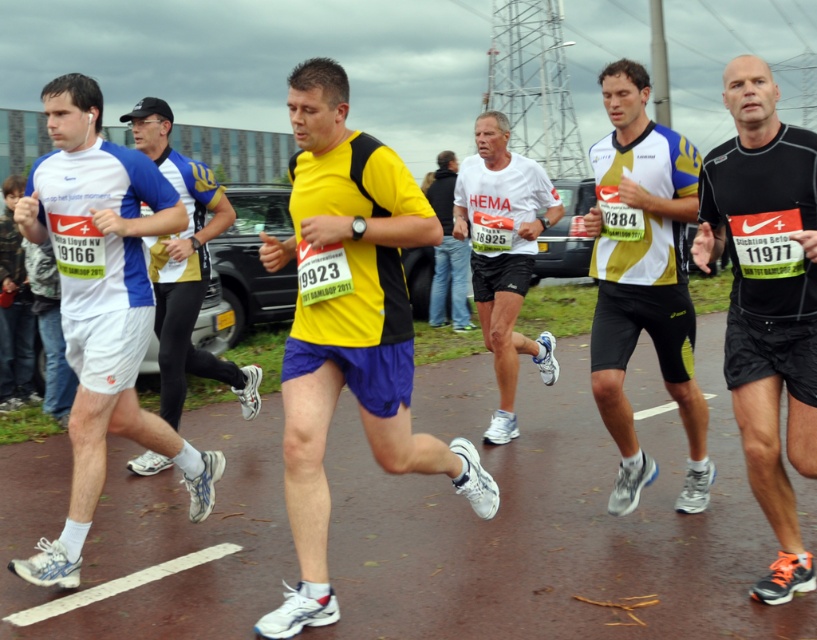
Question: Which point appears farthest from the camera in this image?

Choices:
 (A) (761, 474)
 (B) (485, 163)
 (C) (337, 211)
 (D) (436, 272)

Answer: (D)

Question: Does white matte shorts at left appear on the right side of yellow and white jersey at center?

Choices:
 (A) yes
 (B) no

Answer: (B)

Question: Is yellow matte shirt at center closer to the viewer compared to blue jersey at left?

Choices:
 (A) yes
 (B) no

Answer: (A)

Question: Can you confirm if yellow and white jersey at center is positioned to the right of white matte shirt at center?

Choices:
 (A) no
 (B) yes

Answer: (B)

Question: Which is farther from the blue jersey at left?

Choices:
 (A) yellow and white jersey at center
 (B) white matte shirt at center

Answer: (A)

Question: Which point is farther from the camera taking this photo?

Choices:
 (A) (302, 534)
 (B) (148, 224)
 (C) (780, 205)

Answer: (B)